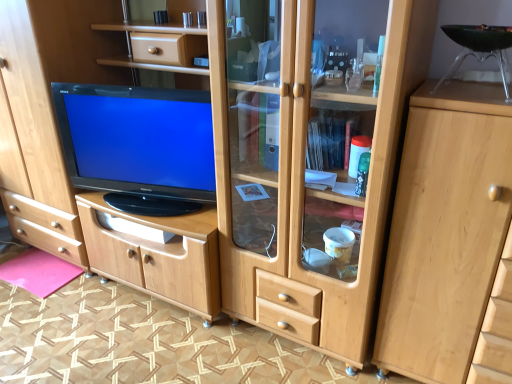
Question: Is pink felt mat at lower left to the left of black glossy television at center from the viewer's perspective?

Choices:
 (A) yes
 (B) no

Answer: (A)

Question: Is pink felt mat at lower left smaller than black glossy television at center?

Choices:
 (A) yes
 (B) no

Answer: (A)

Question: Is pink felt mat at lower left touching black glossy television at center?

Choices:
 (A) yes
 (B) no

Answer: (B)

Question: From a real-world perspective, is pink felt mat at lower left positioned under black glossy television at center based on gravity?

Choices:
 (A) no
 (B) yes

Answer: (B)

Question: Can we say pink felt mat at lower left lies outside black glossy television at center?

Choices:
 (A) no
 (B) yes

Answer: (B)

Question: Is light wood cabinet at right in front of or behind black glossy television at center in the image?

Choices:
 (A) behind
 (B) front

Answer: (B)

Question: Would you say light wood cabinet at right is to the left or to the right of black glossy television at center in the picture?

Choices:
 (A) left
 (B) right

Answer: (B)

Question: From a real-world perspective, is light wood cabinet at right physically located above or below black glossy television at center?

Choices:
 (A) below
 (B) above

Answer: (A)

Question: Based on their sizes in the image, would you say light wood cabinet at right is bigger or smaller than black glossy television at center?

Choices:
 (A) big
 (B) small

Answer: (A)

Question: Is point (458, 158) closer or farther from the camera than point (27, 286)?

Choices:
 (A) closer
 (B) farther

Answer: (A)

Question: Considering the positions of light wood cabinet at right and pink felt mat at lower left in the image, is light wood cabinet at right bigger or smaller than pink felt mat at lower left?

Choices:
 (A) small
 (B) big

Answer: (B)

Question: In terms of height, does light wood cabinet at right look taller or shorter compared to pink felt mat at lower left?

Choices:
 (A) tall
 (B) short

Answer: (A)

Question: In the image, is light wood cabinet at right positioned in front of or behind pink felt mat at lower left?

Choices:
 (A) front
 (B) behind

Answer: (A)

Question: In terms of size, does pink felt mat at lower left appear bigger or smaller than light wood cabinet at right?

Choices:
 (A) big
 (B) small

Answer: (B)

Question: Considering the positions of point (52, 261) and point (482, 240), is point (52, 261) closer or farther from the camera than point (482, 240)?

Choices:
 (A) closer
 (B) farther

Answer: (B)